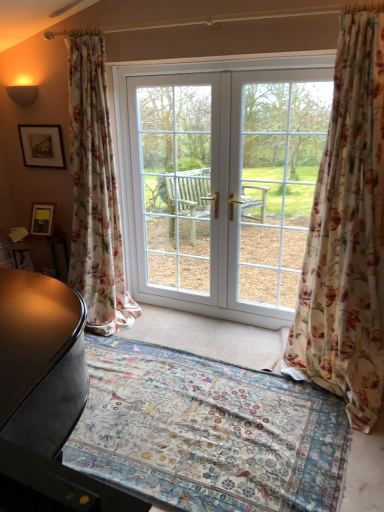
The image size is (384, 512). What do you see at coordinates (275, 181) in the screenshot?
I see `white glass door at center` at bounding box center [275, 181].

The image size is (384, 512). Describe the element at coordinates (221, 185) in the screenshot. I see `white glossy door at center` at that location.

Find the location of `matte black picture frame at upper left`. matte black picture frame at upper left is located at coordinates (42, 146).

Locate an element on the screen. The height and width of the screenshot is (512, 384). floral carpet at center is located at coordinates (208, 432).

Identify the location of floral fabric curtain at right, arranged as the first curtain when viewed from the right. (348, 234).

From the image's perspective, which one is positioned lower, matte black picture frame at upper left or floral fabric curtain at left, placed as the 1th curtain when sorted from left to right?

floral fabric curtain at left, placed as the 1th curtain when sorted from left to right.

Find the location of a particular element. The image size is (384, 512). picture frame above the floral fabric curtain at left, which is counted as the second curtain, starting from the right (from the image's perspective) is located at coordinates (42, 146).

Which is nearer, (34, 126) or (88, 156)?

Point (88, 156)

Can you confirm if matte black picture frame at upper left is taller than floral fabric curtain at left, placed as the 1th curtain when sorted from left to right?

No, matte black picture frame at upper left is not taller than floral fabric curtain at left, placed as the 1th curtain when sorted from left to right.

How distant is white glass door at center from floral carpet at center?

1.35 meters.

Between white glass door at center and floral carpet at center, which one has less height?

Standing shorter between the two is floral carpet at center.

Is white glass door at center bigger than floral carpet at center?

Yes, white glass door at center is bigger than floral carpet at center.

Would you say white glass door at center is to the left or to the right of floral carpet at center in the picture?

white glass door at center is to the right of floral carpet at center.

Is floral carpet at center oriented towards white glass door at center?

No, floral carpet at center is not oriented towards white glass door at center.

How far apart are floral carpet at center and white glass door at center?

1.35 meters.

Considering their positions, is floral carpet at center located in front of or behind white glass door at center?

floral carpet at center is in front of white glass door at center.

Between floral carpet at center and white glass door at center, which one appears on the right side from the viewer's perspective?

Positioned to the right is white glass door at center.

Locate an element on the screen. The height and width of the screenshot is (512, 384). door above the floral carpet at center (from a real-world perspective) is located at coordinates (221, 185).

Is floral carpet at center placed right next to white glossy door at center?

floral carpet at center and white glossy door at center are clearly separated.

Is floral carpet at center at the right side of white glossy door at center?

No, floral carpet at center is not to the right of white glossy door at center.

Is floral fabric curtain at right, arranged as the first curtain when viewed from the right, facing away from floral carpet at center?

No, floral fabric curtain at right, arranged as the first curtain when viewed from the right, is not facing away from floral carpet at center.

How different are the orientations of floral fabric curtain at right, arranged as the first curtain when viewed from the right, and floral carpet at center in degrees?

They differ by 3.47 degrees in their facing directions.

From the image's perspective, between floral fabric curtain at right, arranged as the first curtain when viewed from the right, and floral carpet at center, who is located below?

floral carpet at center, from the image's perspective.

At what (x,y) coordinates should I click in order to perform the action: click on window screen that appears below the floral fabric curtain at left, placed as the 1th curtain when sorted from left to right (from a real-world perspective). Please return your answer as a coordinate pair (x, y). This screenshot has height=512, width=384. Looking at the image, I should click on (275, 181).

From the image's perspective, relative to white glass door at center, is floral fabric curtain at left, placed as the 1th curtain when sorted from left to right, above or below?

floral fabric curtain at left, placed as the 1th curtain when sorted from left to right, is situated higher than white glass door at center in the image.

Relative to white glass door at center, is floral fabric curtain at left, which is counted as the second curtain, starting from the right, in front or behind?

Clearly, floral fabric curtain at left, which is counted as the second curtain, starting from the right, is in front of white glass door at center.

Does point (83, 85) come closer to viewer compared to point (266, 206)?

Yes, it is.

Are matte black picture frame at upper left and white glossy door at center beside each other?

No, matte black picture frame at upper left is not with white glossy door at center.

Which is in front, point (45, 141) or point (201, 253)?

The point (45, 141) is in front.

This screenshot has height=512, width=384. There is a floral fabric curtain at left, which is counted as the second curtain, starting from the right. In order to click on picture frame above it (from a real-world perspective) in this screenshot , I will do `click(42, 146)`.

This screenshot has height=512, width=384. In order to click on window screen lying on the right of floral carpet at center in this screenshot , I will do `click(275, 181)`.

Looking at the image, which one is located closer to floral carpet at center, floral fabric curtain at left, placed as the 1th curtain when sorted from left to right, or white glass door at center?

floral fabric curtain at left, placed as the 1th curtain when sorted from left to right, is positioned closer to the anchor floral carpet at center.

Estimate the real-world distances between objects in this image. Which object is further from floral fabric curtain at left, which is counted as the second curtain, starting from the right, matte black picture frame at upper left or floral carpet at center?

floral carpet at center is positioned further to the anchor floral fabric curtain at left, which is counted as the second curtain, starting from the right.

Looking at the image, which one is located further to white glass door at center, floral fabric curtain at right, which ranks as the second curtain in left-to-right order, or white glossy door at center?

Based on the image, floral fabric curtain at right, which ranks as the second curtain in left-to-right order, appears to be further to white glass door at center.

Which object lies further to the anchor point floral fabric curtain at right, arranged as the first curtain when viewed from the right, floral carpet at center or white glossy door at center?

Based on the image, white glossy door at center appears to be further to floral fabric curtain at right, arranged as the first curtain when viewed from the right.

Looking at the image, which one is located closer to white glossy door at center, floral fabric curtain at right, arranged as the first curtain when viewed from the right, or matte black picture frame at upper left?

floral fabric curtain at right, arranged as the first curtain when viewed from the right, lies closer to white glossy door at center than the other object.

Estimate the real-world distances between objects in this image. Which object is further from white glossy door at center, floral fabric curtain at left, which is counted as the second curtain, starting from the right, or white glass door at center?

floral fabric curtain at left, which is counted as the second curtain, starting from the right, is positioned further to the anchor white glossy door at center.

Estimate the real-world distances between objects in this image. Which object is closer to floral fabric curtain at right, arranged as the first curtain when viewed from the right, matte black picture frame at upper left or floral fabric curtain at left, placed as the 1th curtain when sorted from left to right?

floral fabric curtain at left, placed as the 1th curtain when sorted from left to right, is positioned closer to the anchor floral fabric curtain at right, arranged as the first curtain when viewed from the right.

Looking at the image, which one is located closer to floral carpet at center, white glass door at center or floral fabric curtain at right, arranged as the first curtain when viewed from the right?

The object closer to floral carpet at center is floral fabric curtain at right, arranged as the first curtain when viewed from the right.

Identify the location of curtain between matte black picture frame at upper left and floral fabric curtain at right, arranged as the first curtain when viewed from the right, in the horizontal direction. (95, 191).

Where is `curtain between white glossy door at center and floral carpet at center vertically`? The image size is (384, 512). curtain between white glossy door at center and floral carpet at center vertically is located at coordinates (348, 234).

This screenshot has height=512, width=384. In order to click on door between floral fabric curtain at left, which is counted as the second curtain, starting from the right, and floral fabric curtain at right, arranged as the first curtain when viewed from the right, from left to right in this screenshot , I will do `click(221, 185)`.

Identify the location of mat located between floral fabric curtain at left, placed as the 1th curtain when sorted from left to right, and floral fabric curtain at right, arranged as the first curtain when viewed from the right, in the left-right direction. This screenshot has height=512, width=384. (208, 432).